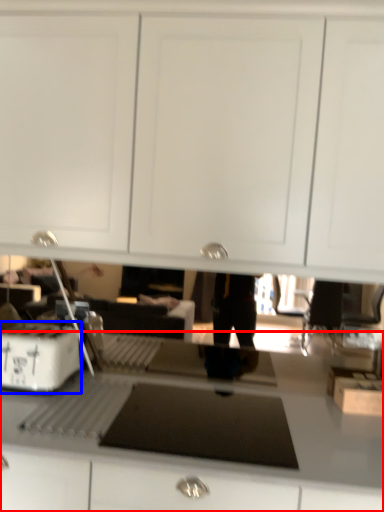
Question: Which of the following is the farthest to the observer, countertop (highlighted by a red box) or home appliance (highlighted by a blue box)?

Choices:
 (A) countertop
 (B) home appliance

Answer: (B)